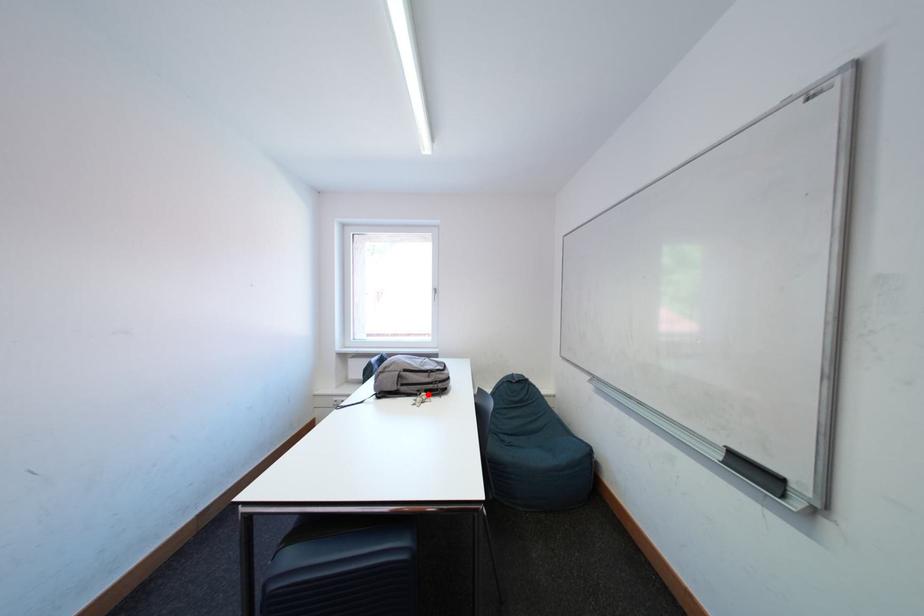
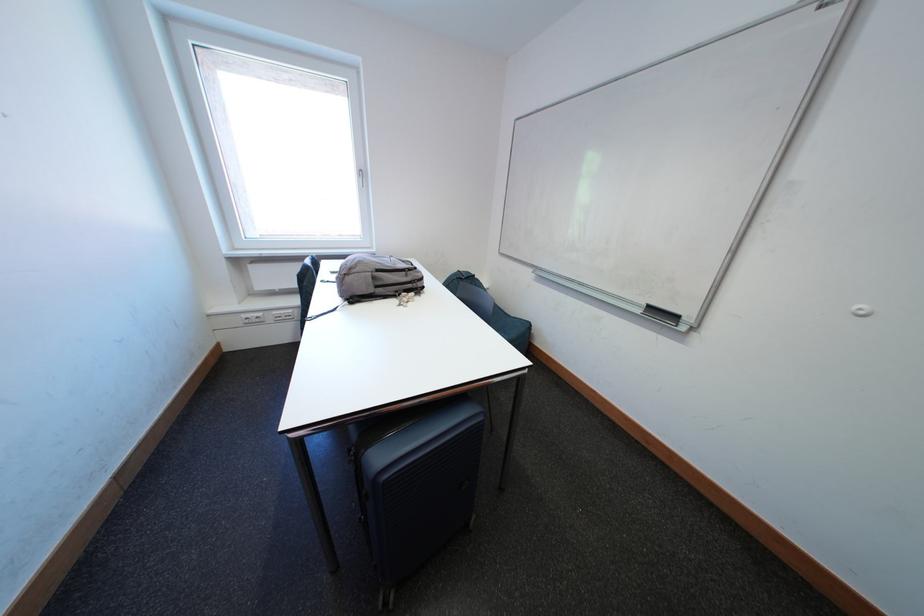
Where in the second image is the point corresponding to the highlighted location from the first image?

(406, 294)